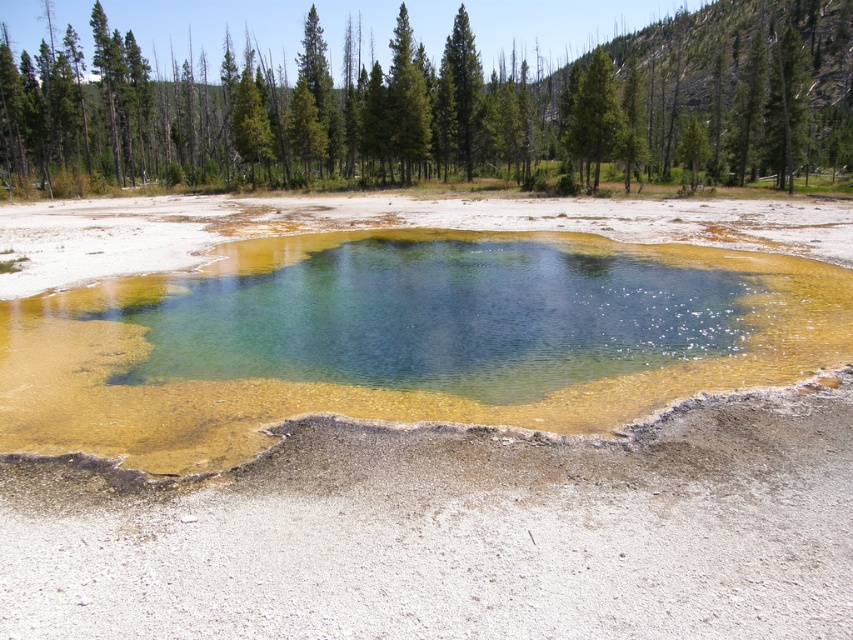
Is green textured tree at upper center to the right of green coniferous tree at upper center from the viewer's perspective?

Indeed, green textured tree at upper center is positioned on the right side of green coniferous tree at upper center.

Does green textured tree at upper center have a larger size compared to green coniferous tree at upper center?

Yes, green textured tree at upper center is bigger than green coniferous tree at upper center.

Identify the location of green textured tree at upper center. The width and height of the screenshot is (853, 640). (595, 116).

Which is above, green leafy tree at upper center or green coniferous tree at upper center?

green leafy tree at upper center is higher up.

Does green leafy tree at upper center have a larger size compared to green coniferous tree at upper center?

Yes.

Image resolution: width=853 pixels, height=640 pixels. Find the location of `green leafy tree at upper center`. green leafy tree at upper center is located at coordinates (442, 108).

The height and width of the screenshot is (640, 853). Identify the location of green leafy tree at upper center. (442, 108).

Locate an element on the screen. This screenshot has height=640, width=853. green leafy tree at upper center is located at coordinates (442, 108).

Who is more forward, (701, 49) or (573, 100)?

Point (573, 100) is more forward.

Find the location of `green leafy tree at upper center`. green leafy tree at upper center is located at coordinates (442, 108).